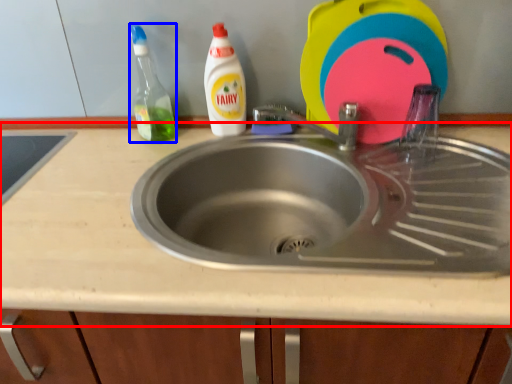
Question: Which object appears farthest to the camera in this image, countertop (highlighted by a red box) or cleaning product (highlighted by a blue box)?

Choices:
 (A) countertop
 (B) cleaning product

Answer: (B)